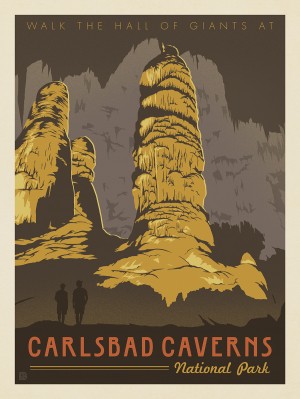
Where is `cream border`? This screenshot has width=300, height=399. cream border is located at coordinates (6, 251), (125, 388), (294, 219), (160, 5).